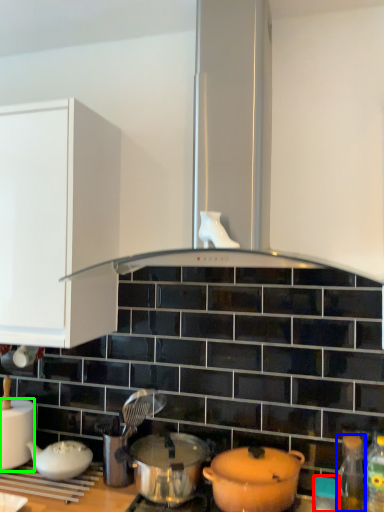
Question: Which object is the closest to the appliance (highlighted by a red box)? Choose among these: bottle (highlighted by a blue box) or kitchen appliance (highlighted by a green box).

Choices:
 (A) bottle
 (B) kitchen appliance

Answer: (A)